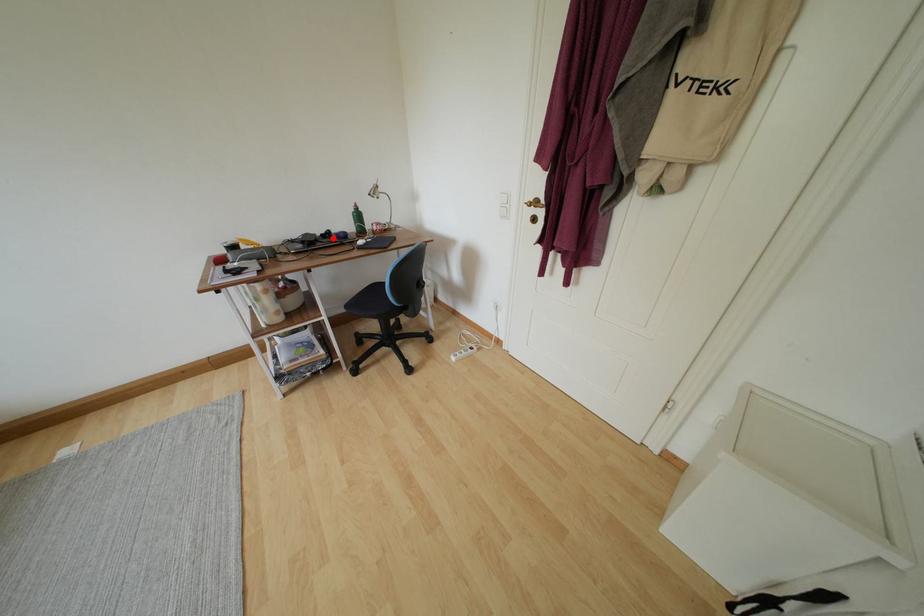
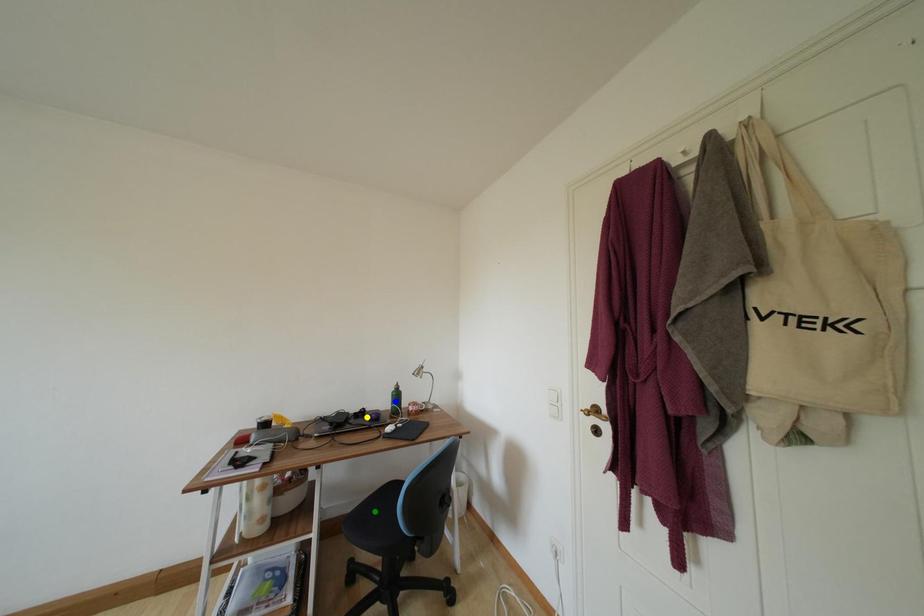
Question: I am providing you with two images of the same scene from different viewpoints. A red point is marked on the first image. You are given multiple points on the second image. Which point in image 2 is actually the same real-world point as the red point in image 1?

Choices:
 (A) green point
 (B) yellow point
 (C) blue point

Answer: (B)